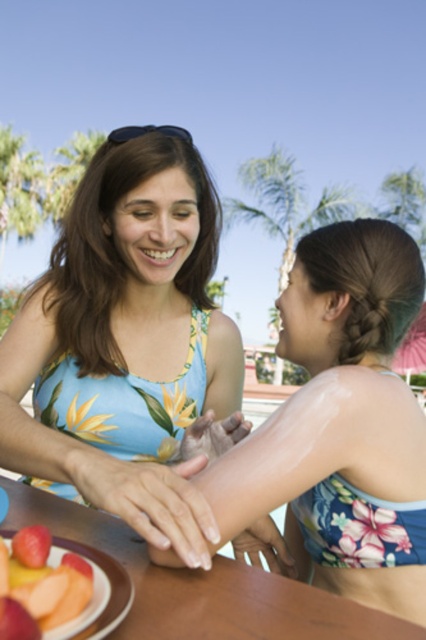
Between point (362, 541) and point (302, 586), which one is positioned in front?

Point (302, 586) is in front.

Is point (238, 492) more distant than point (0, 481)?

No, (238, 492) is in front of (0, 481).

Does point (370, 310) come behind point (94, 515)?

Yes, point (370, 310) is behind point (94, 515).

Locate an element on the screen. This screenshot has height=640, width=426. floral bikini top at center is located at coordinates (339, 420).

Which is below, blue floral swimsuit at center or smooth pinkish-orange slices at lower left?

smooth pinkish-orange slices at lower left is below.

Does point (129, 280) come closer to viewer compared to point (71, 580)?

No.

You are a GUI agent. You are given a task and a screenshot of the screen. Output one action in this format:
    pyautogui.click(x=<x>, y=<y>)
    Task: Click on the blue floral swimsuit at center
    Image resolution: width=426 pixels, height=640 pixels.
    Given the screenshot: What is the action you would take?
    pyautogui.click(x=126, y=330)

Can you confirm if blue floral swimsuit at center is bigger than floral bikini top at center?

Indeed, blue floral swimsuit at center has a larger size compared to floral bikini top at center.

Looking at this image, between blue floral swimsuit at center and floral bikini top at center, which one has more height?

blue floral swimsuit at center is taller.

Find the location of a particular element. The width and height of the screenshot is (426, 640). blue floral swimsuit at center is located at coordinates (126, 330).